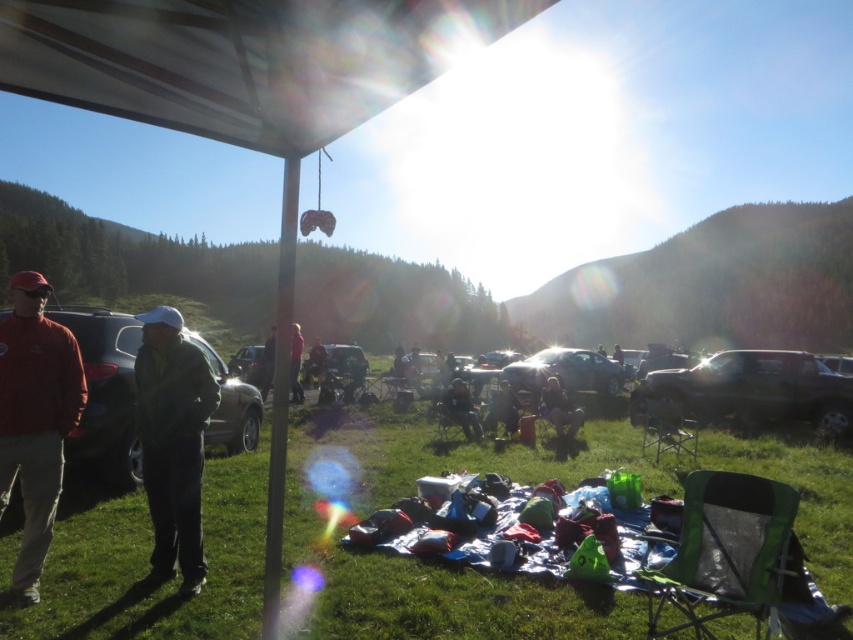
Is point (352, 440) closer to camera compared to point (294, 369)?

Yes.

How much distance is there between green grass at lower center and pink fabric at center?

A distance of 26.35 feet exists between green grass at lower center and pink fabric at center.

Does point (134, 500) come farther from viewer compared to point (291, 385)?

No, (134, 500) is closer to viewer.

Locate an element on the screen. The image size is (853, 640). green grass at lower center is located at coordinates (434, 563).

Can you confirm if green grass at lower center is smaller than green matte jacket at left?

Incorrect, green grass at lower center is not smaller in size than green matte jacket at left.

Can you confirm if green grass at lower center is bigger than green matte jacket at left?

Yes, green grass at lower center is bigger than green matte jacket at left.

Is point (368, 433) behind point (173, 317)?

Yes, point (368, 433) is farther from viewer.

Find the location of a particular element. The height and width of the screenshot is (640, 853). green grass at lower center is located at coordinates (434, 563).

Between point (140, 518) and point (798, 358), which one is positioned in front?

Positioned in front is point (140, 518).

Where is `green grass at lower center`? green grass at lower center is located at coordinates (434, 563).

Does point (453, 604) come behind point (833, 435)?

That is False.

Locate an element on the screen. The height and width of the screenshot is (640, 853). green grass at lower center is located at coordinates click(434, 563).